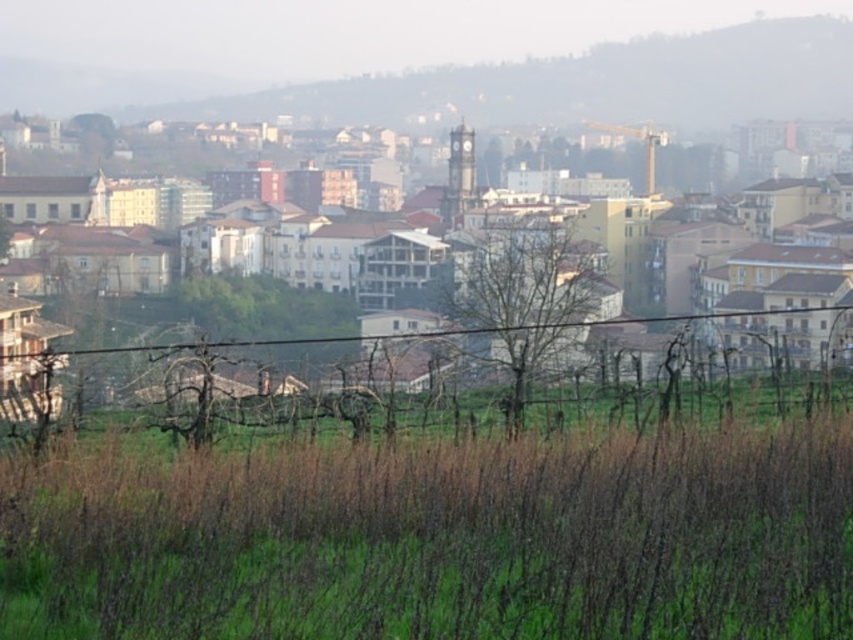
Between brown textured buildings at center and brown wire fence at center, which one has more height?

brown textured buildings at center is taller.

Is brown textured buildings at center to the right of brown wire fence at center from the viewer's perspective?

In fact, brown textured buildings at center is to the left of brown wire fence at center.

Who is more distant from viewer, (287, 246) or (79, 422)?

Point (287, 246)

The width and height of the screenshot is (853, 640). I want to click on brown textured buildings at center, so click(x=729, y=264).

Is green grass at lower center below brown wire fence at center?

Yes, green grass at lower center is below brown wire fence at center.

Is point (161, 458) in front of point (33, 371)?

Yes, point (161, 458) is closer to viewer.

This screenshot has height=640, width=853. What do you see at coordinates (438, 538) in the screenshot?
I see `green grass at lower center` at bounding box center [438, 538].

Identify the location of green grass at lower center. (438, 538).

Does green grass at lower center appear under brown textured buildings at center?

Yes.

Which is behind, point (51, 545) or point (740, 211)?

Positioned behind is point (740, 211).

Which is behind, point (820, 536) or point (838, 262)?

Point (838, 262)

Identify the location of green grass at lower center. The height and width of the screenshot is (640, 853). (438, 538).